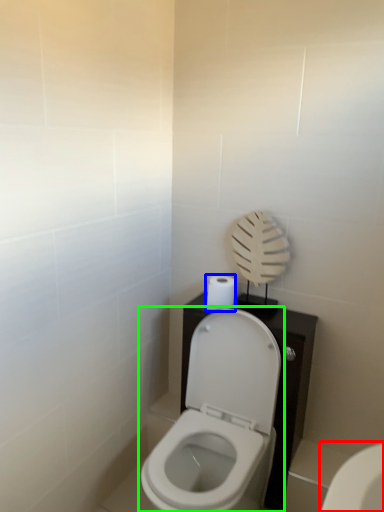
Question: Estimate the real-world distances between objects in this image. Which object is closer to toilet (highlighted by a red box), toilet paper (highlighted by a blue box) or toilet (highlighted by a green box)?

Choices:
 (A) toilet paper
 (B) toilet

Answer: (B)